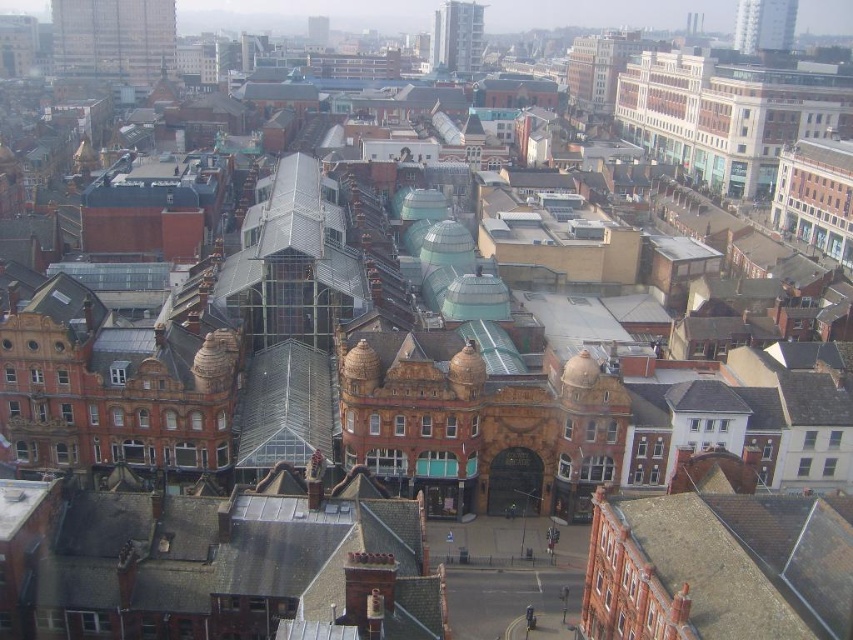
You are a drone operator tasked with capturing aerial footage of the city. Your drone has a maximum flight range of 400 meters. You want to fly from your current position to the metallic glass tower at upper left. Will your drone be able to reach it without exceeding its range?

The metallic glass tower at upper left is 387.30 meters away from the camera. Since the drone has a maximum flight range of 400 meters, it can safely reach the tower without exceeding its range.

You are an architect reviewing an urban plan and see the white glass building at upper center and the smooth glass skyscraper at upper right. Which building is closer to your viewpoint?

The white glass building at upper center is closer to the viewpoint because it is positioned further to the viewer than the smooth glass skyscraper at upper right.